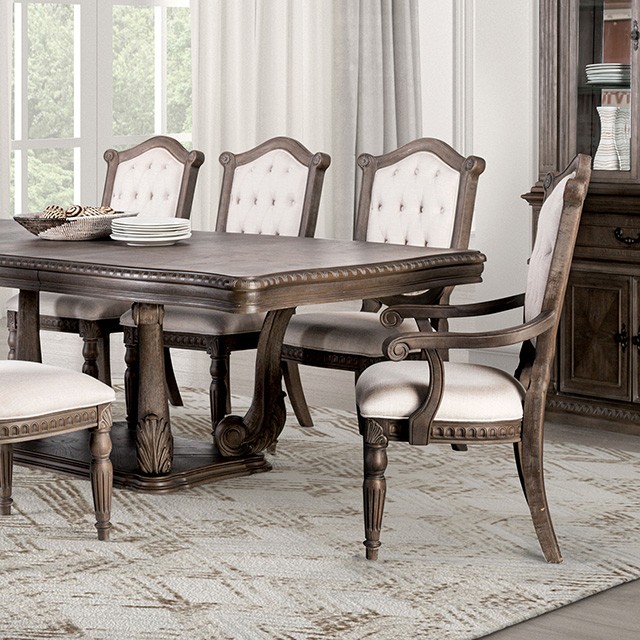
Where is `chairs`? chairs is located at coordinates (486, 385), (429, 171), (266, 180), (161, 186), (45, 392).